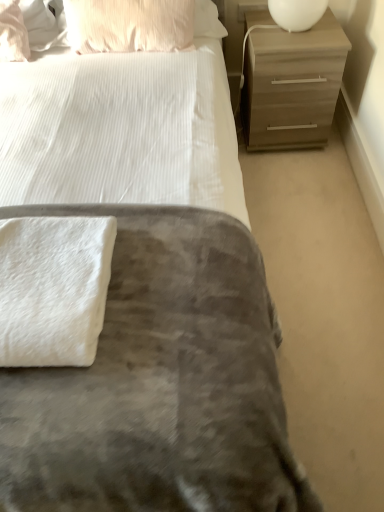
Question: Is the depth of matte brown chest of drawers at upper right greater than that of white glossy lampshade at upper right?

Choices:
 (A) yes
 (B) no

Answer: (A)

Question: Is matte brown chest of drawers at upper right bigger than white glossy lampshade at upper right?

Choices:
 (A) no
 (B) yes

Answer: (B)

Question: From a real-world perspective, is matte brown chest of drawers at upper right over white glossy lampshade at upper right?

Choices:
 (A) no
 (B) yes

Answer: (A)

Question: Is matte brown chest of drawers at upper right positioned before white glossy lampshade at upper right?

Choices:
 (A) yes
 (B) no

Answer: (B)

Question: From a real-world perspective, is matte brown chest of drawers at upper right below white glossy lampshade at upper right?

Choices:
 (A) yes
 (B) no

Answer: (A)

Question: Does point (152, 28) appear closer or farther from the camera than point (41, 230)?

Choices:
 (A) farther
 (B) closer

Answer: (A)

Question: From the image's perspective, is pink textured pillow at upper left, the first pillow in the right-to-left sequence, above or below white fluffy bath towel at lower left?

Choices:
 (A) above
 (B) below

Answer: (A)

Question: In terms of size, does pink textured pillow at upper left, the 2th pillow when ordered from left to right, appear bigger or smaller than white fluffy bath towel at lower left?

Choices:
 (A) big
 (B) small

Answer: (A)

Question: From a real-world perspective, is pink textured pillow at upper left, the 2th pillow when ordered from left to right, above or below white fluffy bath towel at lower left?

Choices:
 (A) below
 (B) above

Answer: (B)

Question: From a real-world perspective, is matte pink pillow at upper left, the 2th pillow positioned from the right, positioned above or below matte brown chest of drawers at upper right?

Choices:
 (A) above
 (B) below

Answer: (A)

Question: Would you say matte pink pillow at upper left, the 2th pillow positioned from the right, is to the left or to the right of matte brown chest of drawers at upper right in the picture?

Choices:
 (A) right
 (B) left

Answer: (B)

Question: Is matte pink pillow at upper left, the 2th pillow positioned from the right, taller or shorter than matte brown chest of drawers at upper right?

Choices:
 (A) short
 (B) tall

Answer: (A)

Question: Is matte pink pillow at upper left, acting as the first pillow starting from the left, wider or thinner than matte brown chest of drawers at upper right?

Choices:
 (A) wide
 (B) thin

Answer: (B)

Question: From the image's perspective, is white fluffy bath towel at lower left located above or below matte brown chest of drawers at upper right?

Choices:
 (A) below
 (B) above

Answer: (A)

Question: Relative to matte brown chest of drawers at upper right, is white fluffy bath towel at lower left in front or behind?

Choices:
 (A) front
 (B) behind

Answer: (A)